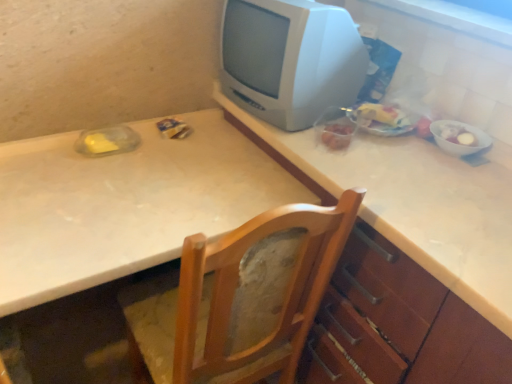
This screenshot has width=512, height=384. In order to click on free space to the left of white glossy bowl at right, arranged as the first food when viewed from the right in this screenshot , I will do `click(409, 146)`.